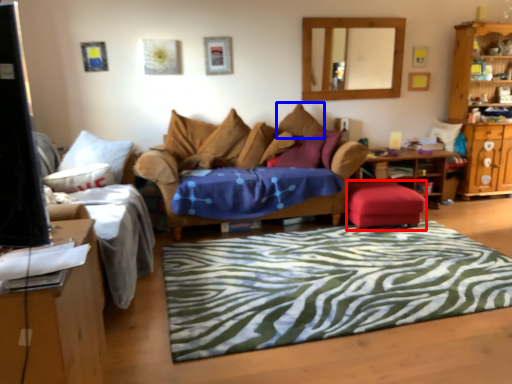
Question: Which of the following is the closest to the observer, stool (highlighted by a red box) or pillow (highlighted by a blue box)?

Choices:
 (A) stool
 (B) pillow

Answer: (A)